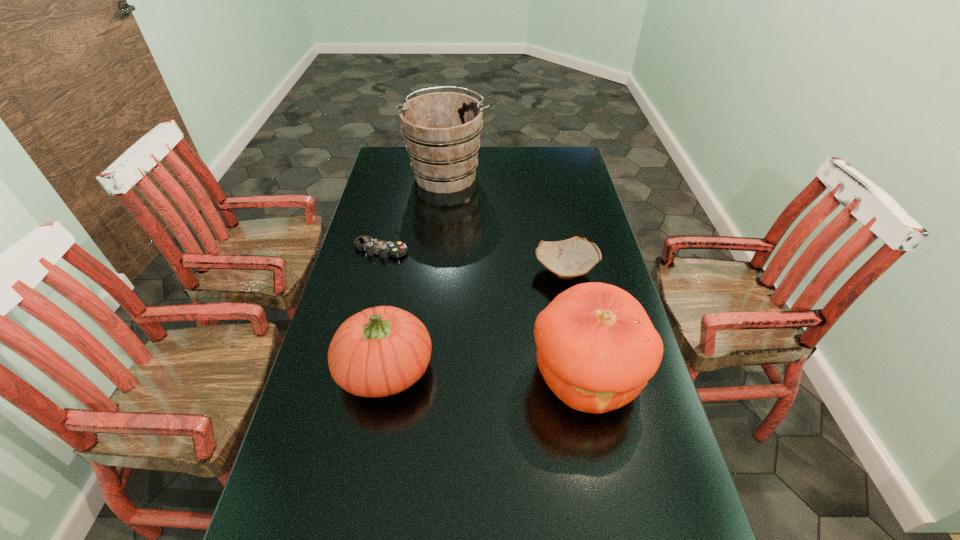
This screenshot has width=960, height=540. In the image, there is a desktop. Identify the location of free space at the left edge. (333, 323).

Locate an element on the screen. Image resolution: width=960 pixels, height=540 pixels. blank space at the right edge is located at coordinates (548, 192).

Locate an element on the screen. This screenshot has height=540, width=960. vacant space at the far left corner of the desktop is located at coordinates (406, 158).

Locate an element on the screen. free space between the control and the taller pumpkin is located at coordinates (483, 313).

You are a GUI agent. You are given a task and a screenshot of the screen. Output one action in this format:
    pyautogui.click(x=<x>, y=<y>)
    Task: Click on the vacant space in between the shorter pumpkin and the tallest object
    This screenshot has width=960, height=540.
    Given the screenshot: What is the action you would take?
    pyautogui.click(x=416, y=272)

Find the location of a particular element. This screenshot has width=960, height=540. empty space between the third tallest object and the fourth tallest object is located at coordinates (475, 320).

Identify the location of vacant area that lies between the shortest object and the pottery. (473, 261).

Locate an element on the screen. free space between the farthest object and the fourth shortest object is located at coordinates (516, 275).

You are a GUI agent. You are given a task and a screenshot of the screen. Output one action in this format:
    pyautogui.click(x=<x>, y=<y>)
    Task: Click on the blank region between the shortest object and the tallest object
    The height and width of the screenshot is (540, 960).
    Given the screenshot: What is the action you would take?
    pyautogui.click(x=414, y=212)

Identify the location of free point between the bucket and the pottery. This screenshot has height=540, width=960. (506, 223).